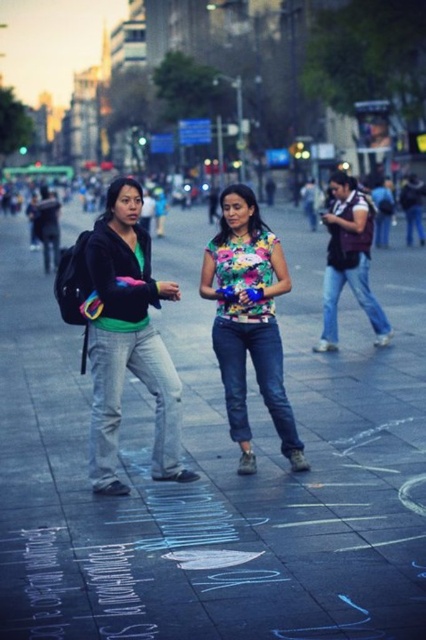
Is smooth concrete sidewalk at center below matte black jacket at left?

Yes, smooth concrete sidewalk at center is below matte black jacket at left.

Does point (345, 323) come farther from viewer compared to point (120, 483)?

That is True.

What do you see at coordinates (216, 467) in the screenshot? I see `smooth concrete sidewalk at center` at bounding box center [216, 467].

Find the location of `smooth concrete sidewalk at center`. smooth concrete sidewalk at center is located at coordinates (216, 467).

Which of these two, matte black jacket at left or floral fabric shirt at center, stands shorter?

With less height is matte black jacket at left.

Is matte black jacket at left positioned behind floral fabric shirt at center?

That is False.

Where is `matte black jacket at left`? This screenshot has height=640, width=426. matte black jacket at left is located at coordinates (129, 340).

I want to click on matte black jacket at left, so click(x=129, y=340).

Image resolution: width=426 pixels, height=640 pixels. What do you see at coordinates (216, 467) in the screenshot?
I see `smooth concrete sidewalk at center` at bounding box center [216, 467].

Between point (368, 468) and point (238, 429), which one is positioned in front?

Point (368, 468) is in front.

I want to click on smooth concrete sidewalk at center, so click(x=216, y=467).